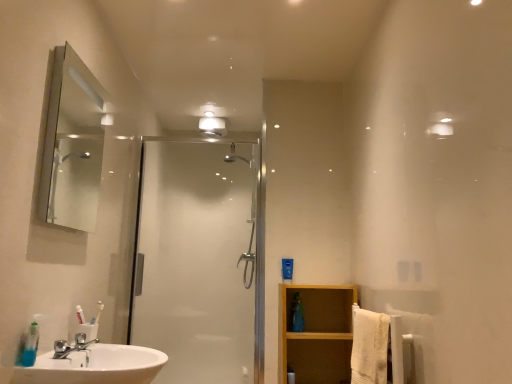
Question: Does white textured towel at right have a greater height compared to clear glass shower door at center?

Choices:
 (A) no
 (B) yes

Answer: (A)

Question: Is white textured towel at right in contact with clear glass shower door at center?

Choices:
 (A) no
 (B) yes

Answer: (A)

Question: Is white textured towel at right shorter than clear glass shower door at center?

Choices:
 (A) yes
 (B) no

Answer: (A)

Question: Does white textured towel at right have a lesser width compared to clear glass shower door at center?

Choices:
 (A) no
 (B) yes

Answer: (B)

Question: Could you tell me if white textured towel at right is turned towards clear glass shower door at center?

Choices:
 (A) no
 (B) yes

Answer: (A)

Question: Does white textured towel at right have a greater width compared to clear glass shower door at center?

Choices:
 (A) yes
 (B) no

Answer: (B)

Question: Considering the relative sizes of white textured towel at right and white glossy light fixture at upper center in the image provided, is white textured towel at right shorter than white glossy light fixture at upper center?

Choices:
 (A) yes
 (B) no

Answer: (B)

Question: From a real-world perspective, is white textured towel at right physically below white glossy light fixture at upper center?

Choices:
 (A) yes
 (B) no

Answer: (A)

Question: Does white textured towel at right come in front of white glossy light fixture at upper center?

Choices:
 (A) yes
 (B) no

Answer: (A)

Question: Can you confirm if white textured towel at right is positioned to the left of white glossy light fixture at upper center?

Choices:
 (A) yes
 (B) no

Answer: (B)

Question: From a real-world perspective, is white textured towel at right positioned over white glossy light fixture at upper center based on gravity?

Choices:
 (A) no
 (B) yes

Answer: (A)

Question: Is white textured towel at right oriented towards white glossy light fixture at upper center?

Choices:
 (A) yes
 (B) no

Answer: (B)

Question: From the image's perspective, is matte silver mirror at upper left beneath clear glass shower door at center?

Choices:
 (A) yes
 (B) no

Answer: (B)